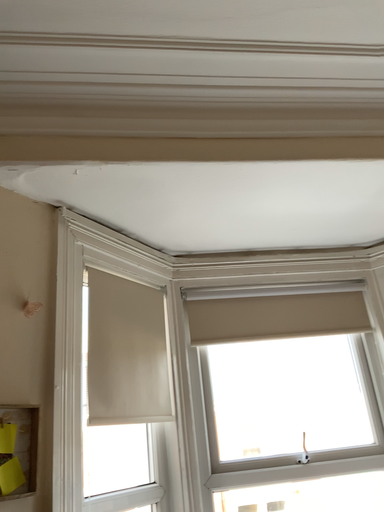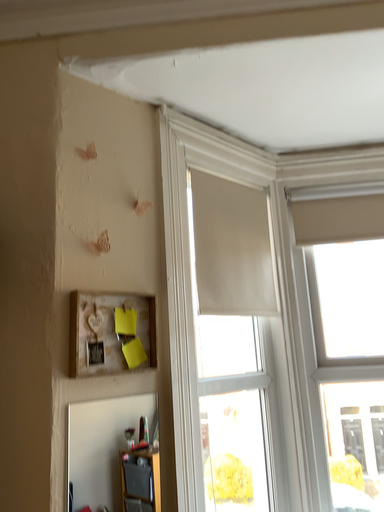
Question: How did the camera likely rotate when shooting the video?

Choices:
 (A) rotated downward
 (B) rotated upward

Answer: (A)